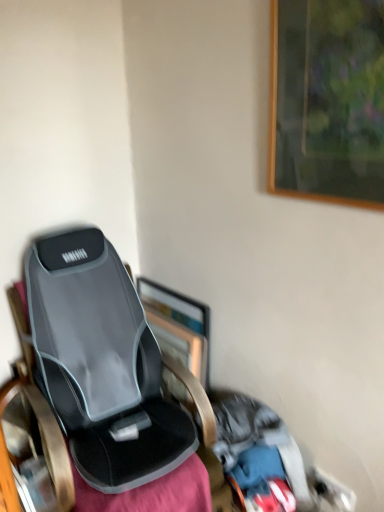
Question: In terms of size, does wooden picture frame at upper right, the second picture frame in the back-to-front sequence, appear bigger or smaller than metallic silver picture frame at center, the first picture frame viewed from the left?

Choices:
 (A) small
 (B) big

Answer: (A)

Question: Is wooden picture frame at upper right, the second picture frame in the back-to-front sequence, in front of or behind metallic silver picture frame at center, the 2th picture frame in the right-to-left sequence, in the image?

Choices:
 (A) front
 (B) behind

Answer: (A)

Question: From the image's perspective, is wooden picture frame at upper right, acting as the first picture frame starting from the front, located above or below metallic silver picture frame at center, the 2th picture frame in the right-to-left sequence?

Choices:
 (A) above
 (B) below

Answer: (A)

Question: From a real-world perspective, is metallic silver picture frame at center, acting as the second picture frame starting from the top, positioned above or below wooden picture frame at upper right, the 1th picture frame from the top?

Choices:
 (A) below
 (B) above

Answer: (A)

Question: Which is correct: metallic silver picture frame at center, the 2th picture frame in the right-to-left sequence, is inside wooden picture frame at upper right, which is counted as the 2th picture frame, starting from the left, or outside of it?

Choices:
 (A) outside
 (B) inside

Answer: (A)

Question: Looking at their shapes, would you say metallic silver picture frame at center, the first picture frame viewed from the left, is wider or thinner than wooden picture frame at upper right, acting as the first picture frame starting from the front?

Choices:
 (A) thin
 (B) wide

Answer: (B)

Question: Visually, is metallic silver picture frame at center, the 2th picture frame in the right-to-left sequence, positioned to the left or to the right of wooden picture frame at upper right, the 2th picture frame positioned from the bottom?

Choices:
 (A) right
 (B) left

Answer: (B)